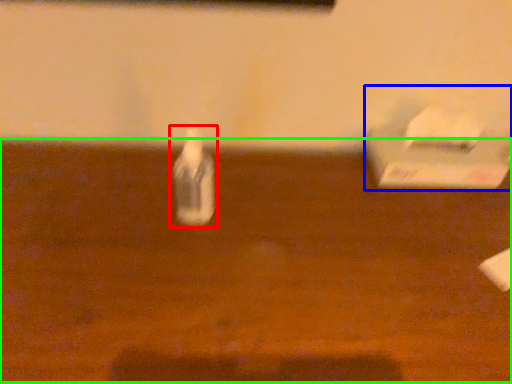
Question: Estimate the real-world distances between objects in this image. Which object is closer to bottle (highlighted by a red box), box (highlighted by a blue box) or table (highlighted by a green box)?

Choices:
 (A) box
 (B) table

Answer: (B)